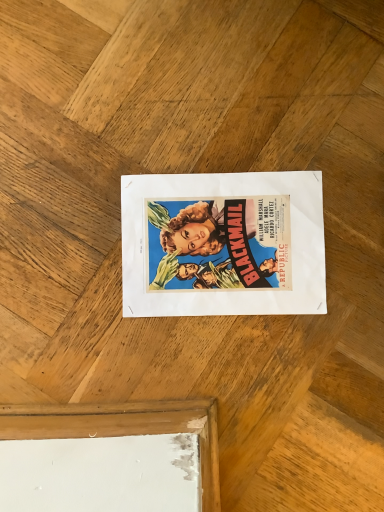
Question: Should I look upward or downward to see matte paper poster at center?

Choices:
 (A) down
 (B) up

Answer: (B)